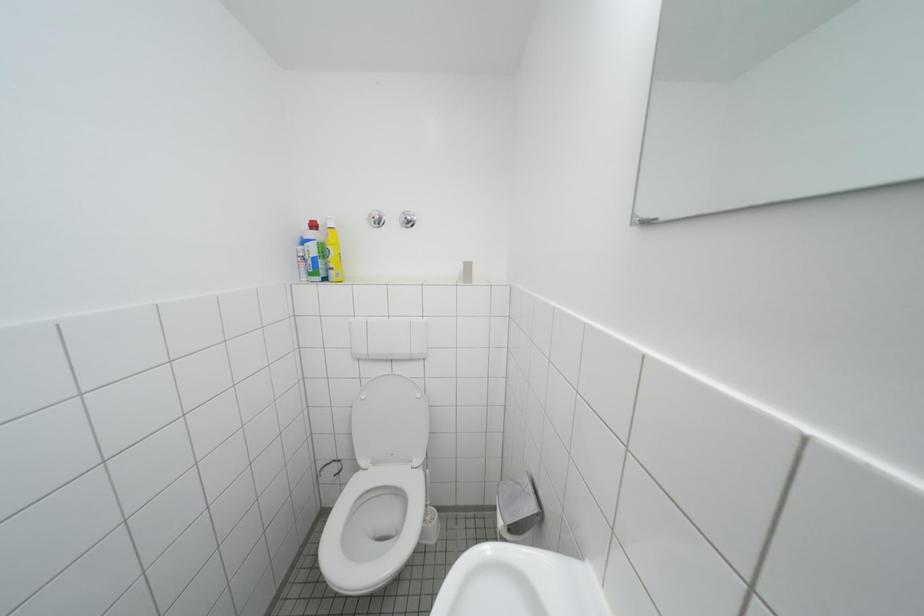
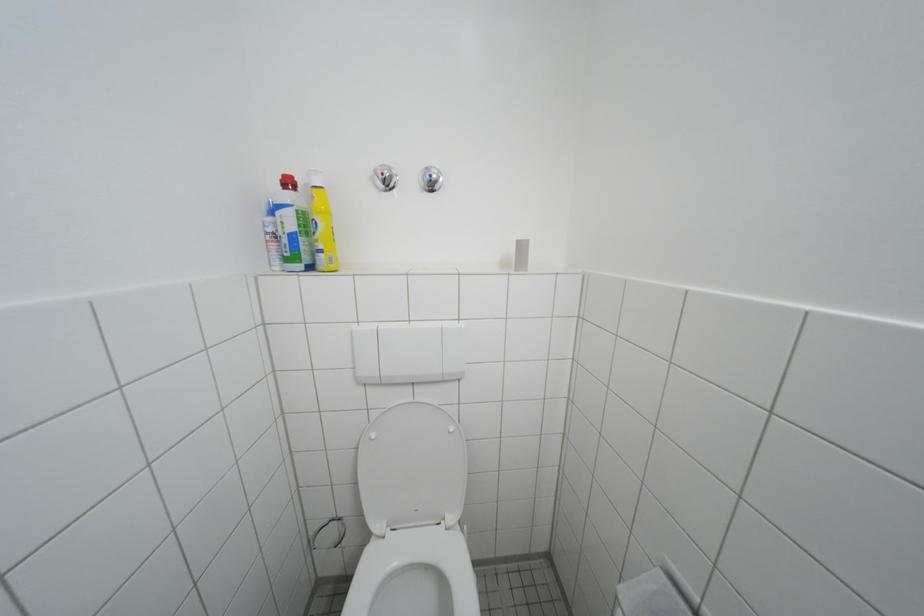
Question: The camera is either moving clockwise (left) or counter-clockwise (right) around the object. The first image is from the beginning of the video and the second image is from the end. Is the camera moving left or right when shooting the video?

Choices:
 (A) Left
 (B) Right

Answer: (A)